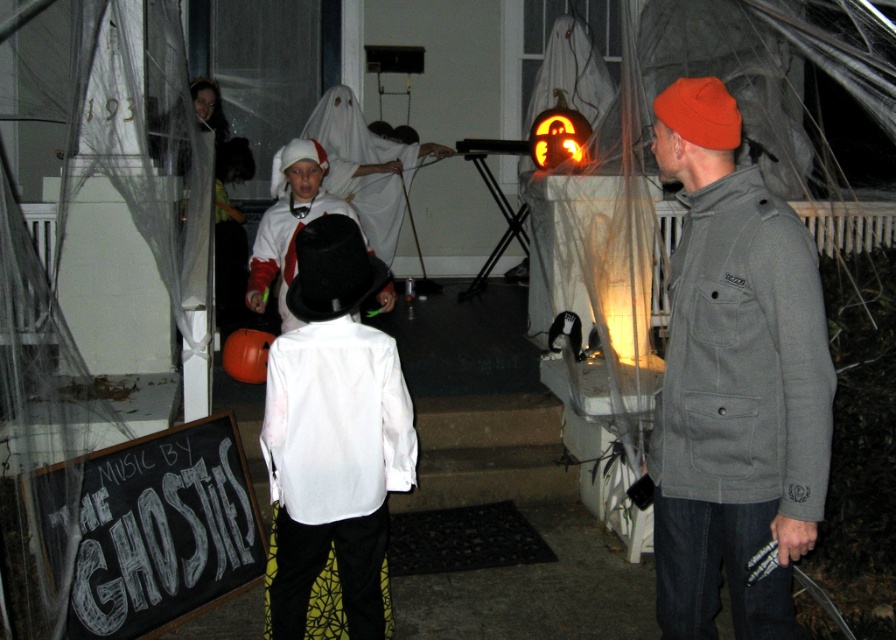
Question: Observing the image, what is the correct spatial positioning of white matte top hat at center in reference to orange carved pumpkin at center?

Choices:
 (A) right
 (B) left

Answer: (B)

Question: Which object appears closest to the camera in this image?

Choices:
 (A) white matte ghost at center
 (B) orange carved pumpkin at center

Answer: (B)

Question: Is the position of orange knit beanie at right less distant than that of white satin shirt at center?

Choices:
 (A) yes
 (B) no

Answer: (A)

Question: Is orange knit beanie at right thinner than orange carved pumpkin at center?

Choices:
 (A) yes
 (B) no

Answer: (A)

Question: Which point is farther from the camera taking this photo?

Choices:
 (A) (392, 230)
 (B) (350, 356)
 (C) (764, 360)
 (D) (296, 230)

Answer: (A)

Question: Which of the following is the farthest from the observer?

Choices:
 (A) (289, 314)
 (B) (297, 632)
 (C) (571, 156)
 (D) (784, 500)

Answer: (C)